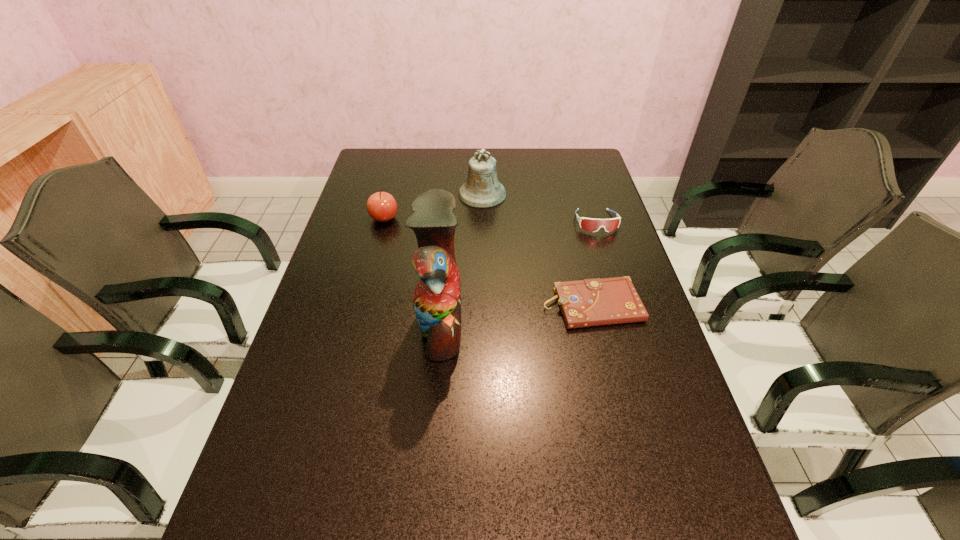
The height and width of the screenshot is (540, 960). I want to click on the tallest object, so click(437, 297).

Where is `bell`? bell is located at coordinates (481, 189).

Locate an element on the screen. The height and width of the screenshot is (540, 960). the fourth shortest object is located at coordinates (481, 189).

At what (x,y) coordinates should I click in order to perform the action: click on the leftmost object. Please return your answer as a coordinate pair (x, y). The height and width of the screenshot is (540, 960). Looking at the image, I should click on (381, 206).

You are a GUI agent. You are given a task and a screenshot of the screen. Output one action in this format:
    pyautogui.click(x=<x>, y=<y>)
    Task: Click on the apple
    
    Given the screenshot: What is the action you would take?
    pyautogui.click(x=381, y=206)

This screenshot has height=540, width=960. What are the coordinates of `goggles` in the screenshot? It's located at (589, 224).

Where is `the shortest object`? The width and height of the screenshot is (960, 540). the shortest object is located at coordinates (590, 302).

What are the coordinates of `vacant position located 0.270m at the face of the tallest object` in the screenshot? It's located at (571, 324).

At what (x,y) coordinates should I click in order to perform the action: click on free space located 0.360m on the front of the second tallest object. Please return your answer as a coordinate pair (x, y). Looking at the image, I should click on (483, 285).

The image size is (960, 540). I want to click on free spot located on the front of the leftmost object, so click(368, 280).